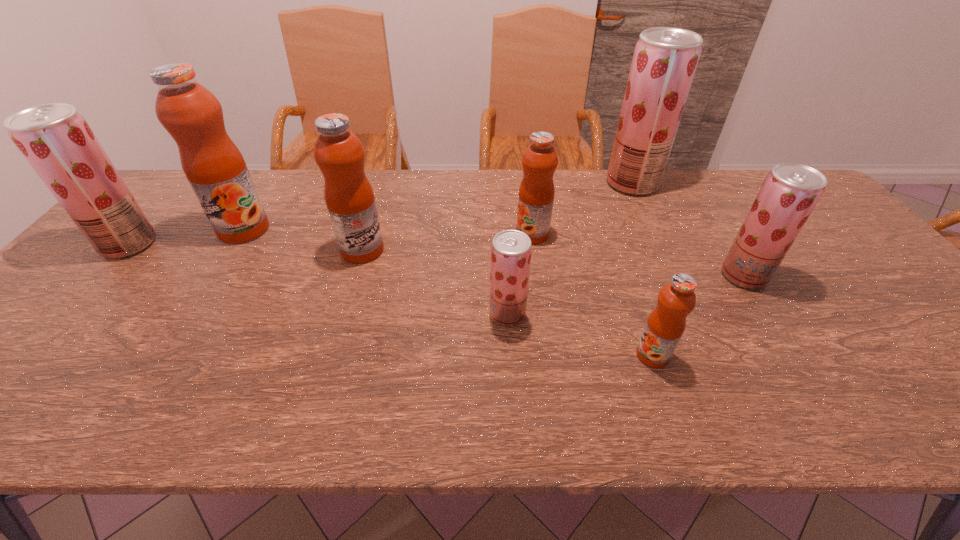
The height and width of the screenshot is (540, 960). Find the location of `vacant region located on the front label of the second smallest orange fruit juice`. vacant region located on the front label of the second smallest orange fruit juice is located at coordinates (418, 234).

In order to click on free location located 0.340m on the front label of the second smallest orange fruit juice in this screenshot , I will do `click(397, 234)`.

You are a GUI agent. You are given a task and a screenshot of the screen. Output one action in this format:
    pyautogui.click(x=<x>, y=<y>)
    Task: Click on the free spot located on the front label of the second smallest orange fruit juice
    The image size is (960, 540).
    Given the screenshot: What is the action you would take?
    pyautogui.click(x=488, y=234)

Identify the location of vacant area located on the back of the second nearest object. (503, 244).

Identify the location of free space located on the front label of the nearest object. (604, 355).

Where is `vacant space located 0.250m on the front label of the nearest object`? vacant space located 0.250m on the front label of the nearest object is located at coordinates (521, 355).

Find the location of `free space located on the front label of the nearest object`. free space located on the front label of the nearest object is located at coordinates (490, 355).

Locate an element on the screen. object that is at the far edge is located at coordinates (665, 59).

Locate an element on the screen. object at the left edge is located at coordinates (56, 140).

In the image, there is a desktop. Where is `vacant space at the far edge`? This screenshot has width=960, height=540. vacant space at the far edge is located at coordinates (579, 170).